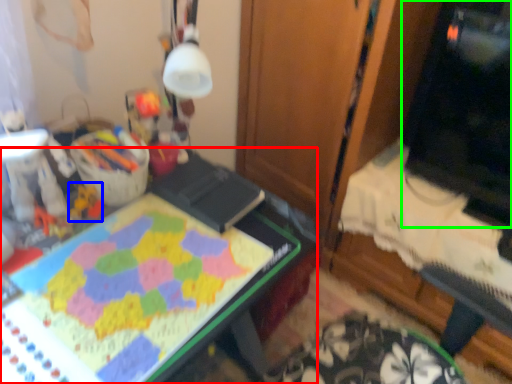
Question: Which is farther away from desk (highlighted by a red box)? toy (highlighted by a blue box) or computer monitor (highlighted by a green box)?

Choices:
 (A) toy
 (B) computer monitor

Answer: (B)